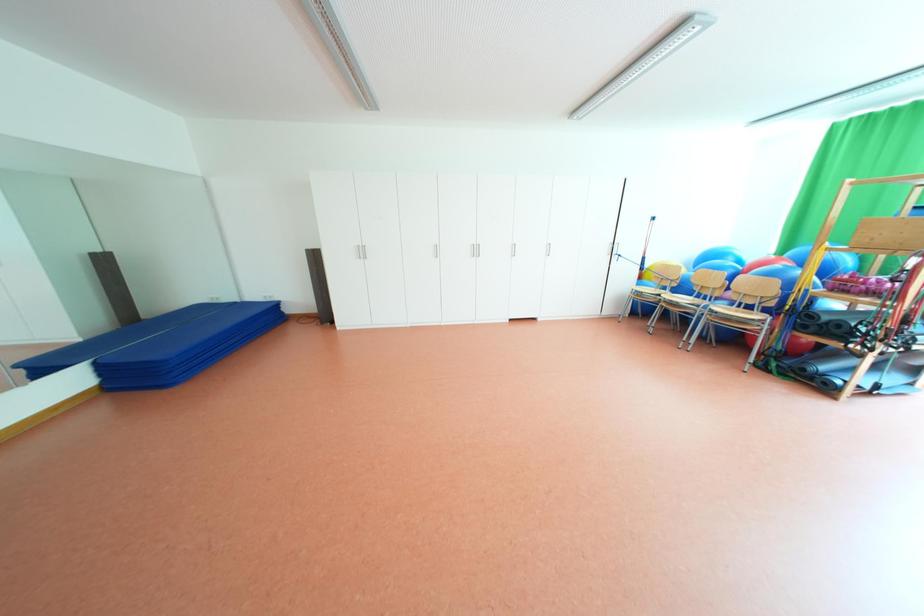
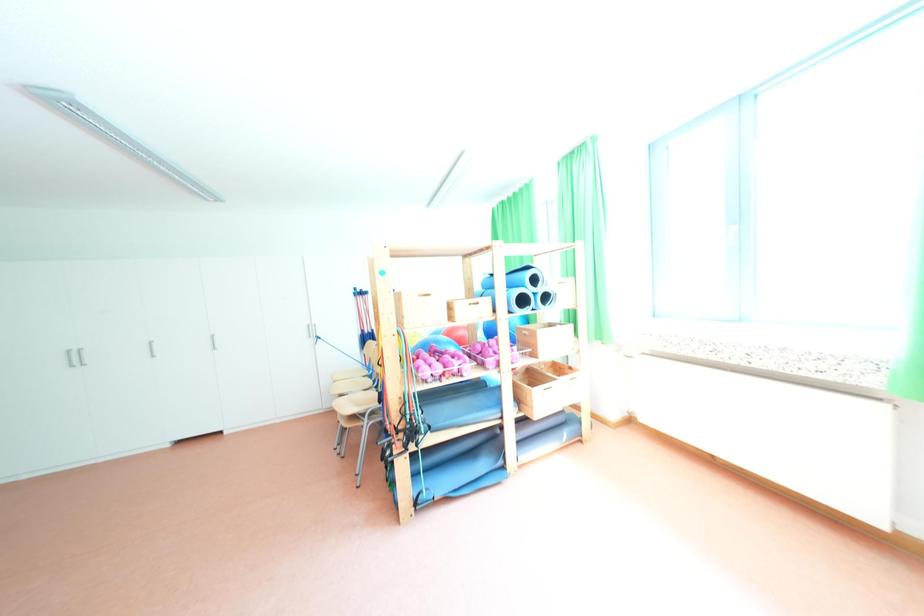
Question: In a continuous first-person perspective shot, in which direction is the camera moving?

Choices:
 (A) Left
 (B) Right
 (C) Forward
 (D) Backward

Answer: (B)